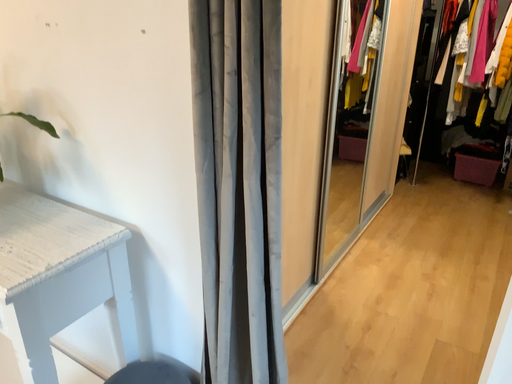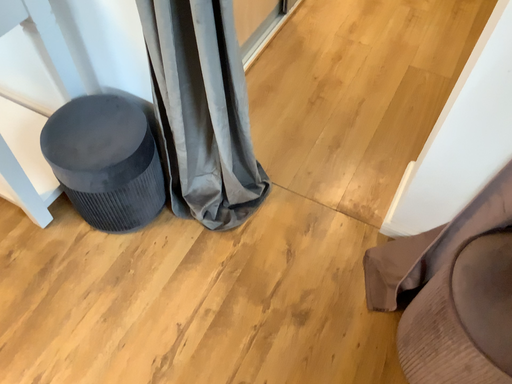
Question: How did the camera likely rotate when shooting the video?

Choices:
 (A) rotated upward
 (B) rotated downward

Answer: (B)